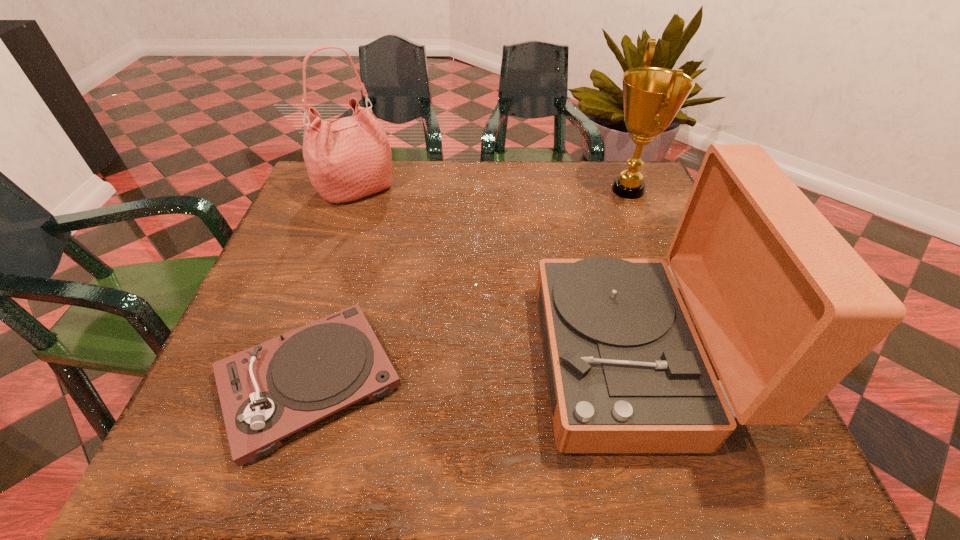
Identify the location of handbag. The image size is (960, 540). (348, 158).

Locate an element on the screen. This screenshot has height=540, width=960. award is located at coordinates (652, 96).

The image size is (960, 540). In order to click on the right phonograph_record in this screenshot , I will do `click(786, 308)`.

At what (x,y) coordinates should I click in order to perform the action: click on the left phonograph_record. Please return your answer as a coordinate pair (x, y). The image size is (960, 540). Looking at the image, I should click on (270, 391).

The image size is (960, 540). I want to click on the shortest object, so click(x=270, y=391).

I want to click on vacant space located 0.190m on the front of the handbag, so (332, 264).

What are the coordinates of `free space located 0.140m on the front view with handles of the award` in the screenshot? It's located at (546, 190).

The height and width of the screenshot is (540, 960). In order to click on vacant area situated on the front view with handles of the award in this screenshot , I will do `click(565, 190)`.

Identify the location of vacant region located on the front view with handles of the award. (550, 190).

Where is `vacant space located on the face of the right phonograph_record`? vacant space located on the face of the right phonograph_record is located at coordinates (343, 359).